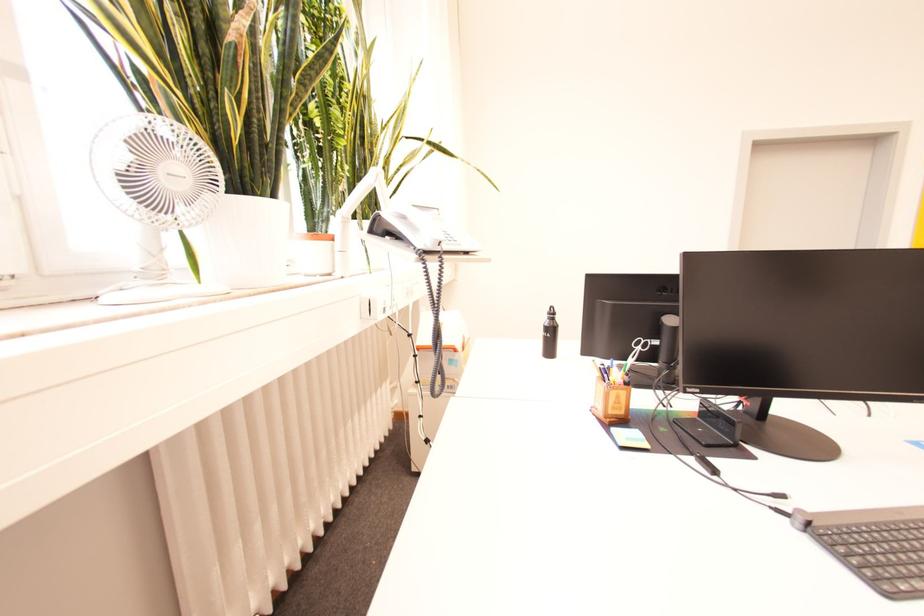
Image resolution: width=924 pixels, height=616 pixels. I want to click on telephone handset, so click(x=420, y=229).